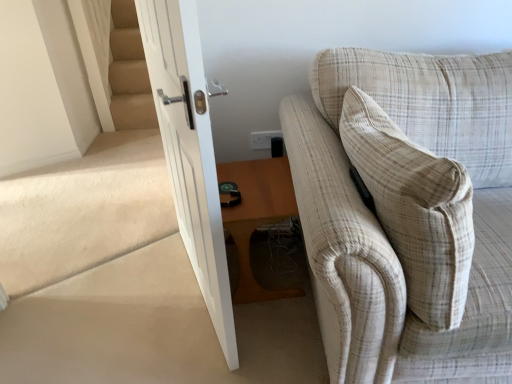
Question: From their relative heights in the image, would you say white plastic electric outlet at upper center is taller or shorter than beige plaid fabric couch at right?

Choices:
 (A) short
 (B) tall

Answer: (A)

Question: Visually, is white plastic electric outlet at upper center positioned to the left or to the right of beige plaid fabric couch at right?

Choices:
 (A) left
 (B) right

Answer: (A)

Question: Which is farther from the beige carpeted stairs at left?

Choices:
 (A) white plastic electric outlet at upper center
 (B) white glossy door at center
 (C) wooden table at lower center
 (D) beige plaid pillow at right
 (E) beige plaid fabric couch at right

Answer: (D)

Question: Which of these objects is positioned closest to the beige plaid pillow at right?

Choices:
 (A) white glossy door at center
 (B) beige plaid fabric couch at right
 (C) white plastic electric outlet at upper center
 (D) wooden table at lower center
 (E) beige carpeted stairs at left

Answer: (B)